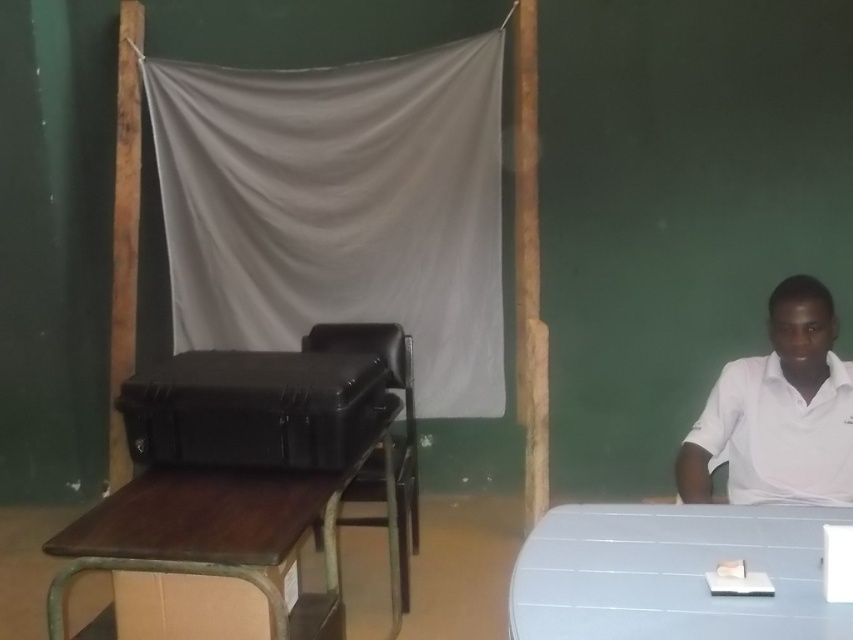
Question: Which object is closer to the camera taking this photo?

Choices:
 (A) white matte shirt at right
 (B) black leather chair at center
 (C) black hard case at center

Answer: (C)

Question: Is gray fabric at center below black leather chair at center?

Choices:
 (A) yes
 (B) no

Answer: (B)

Question: Which point is closer to the camera?

Choices:
 (A) (520, 637)
 (B) (776, 413)
 (C) (287, 371)

Answer: (A)

Question: Does light blue plastic table at lower right have a larger size compared to black leather chair at center?

Choices:
 (A) no
 (B) yes

Answer: (A)

Question: Is gray fabric at center bigger than black leather chair at center?

Choices:
 (A) yes
 (B) no

Answer: (A)

Question: Which of the following is the farthest from the observer?

Choices:
 (A) gray fabric at center
 (B) black hard case at center
 (C) white matte shirt at right

Answer: (A)